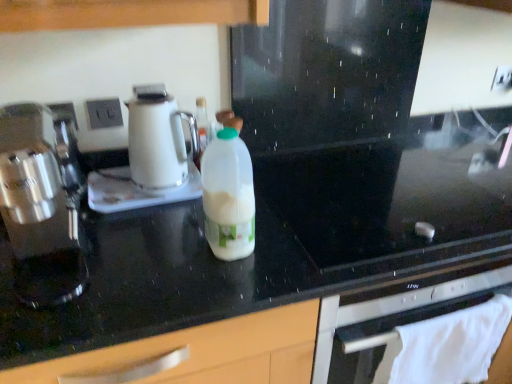
Identify the location of vacant point above white glossy kettle at center (from a real-world perspective). (124, 178).